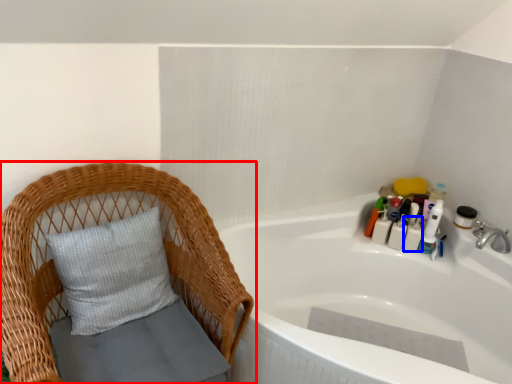
Question: Which object appears closest to the camera in this image, furniture (highlighted by a red box) or toiletry (highlighted by a blue box)?

Choices:
 (A) furniture
 (B) toiletry

Answer: (A)